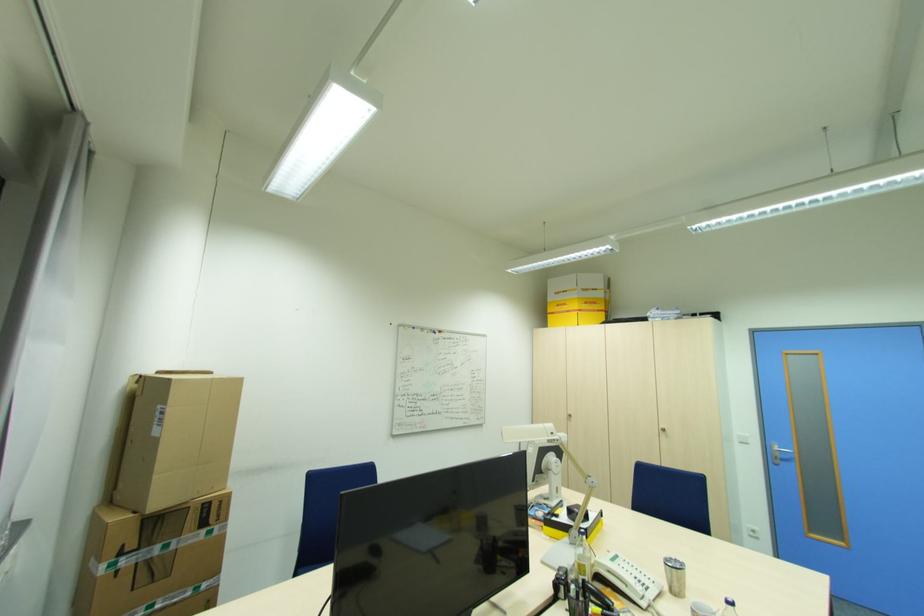
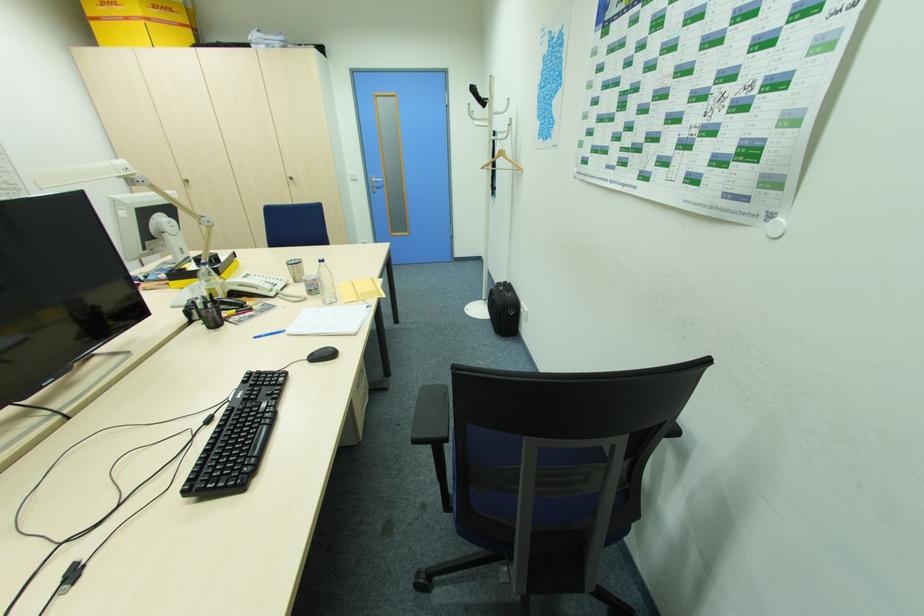
Where in the second image is the point corresponding to (x=570, y=418) from the first image?

(188, 185)